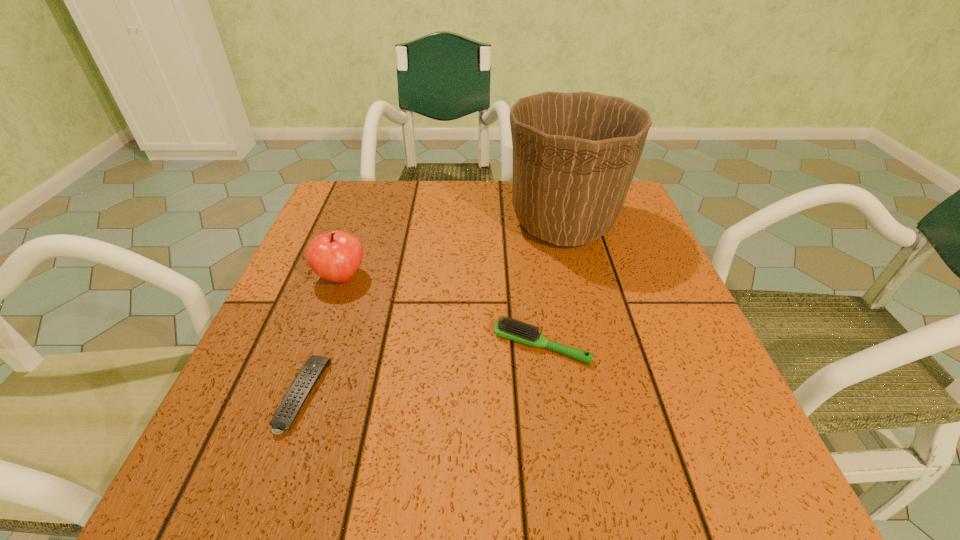
In order to click on object at the far edge in this screenshot , I will do `click(575, 154)`.

Where is `apple at the left edge`? apple at the left edge is located at coordinates (335, 256).

Identify the location of remote control present at the left edge. (294, 399).

Where is `object that is at the right edge`? object that is at the right edge is located at coordinates (575, 154).

The height and width of the screenshot is (540, 960). What are the coordinates of `object present at the far right corner` in the screenshot? It's located at 575,154.

At what (x,y) coordinates should I click in order to perform the action: click on vacant space at the far edge of the desktop. Please return your answer as a coordinate pair (x, y). Image resolution: width=960 pixels, height=540 pixels. Looking at the image, I should click on (404, 204).

You are a GUI agent. You are given a task and a screenshot of the screen. Output one action in this format:
    pyautogui.click(x=<x>, y=<y>)
    Task: Click on the vacant space at the left edge of the desktop
    
    Given the screenshot: What is the action you would take?
    pyautogui.click(x=375, y=235)

Where is `vacant area at the right edge of the desktop`? The height and width of the screenshot is (540, 960). vacant area at the right edge of the desktop is located at coordinates (653, 276).

Image resolution: width=960 pixels, height=540 pixels. What are the coordinates of `vacant space at the near right corner of the desktop` in the screenshot? It's located at (716, 449).

At what (x,y) coordinates should I click in order to perform the action: click on empty space that is in between the remote control and the farthest object. Please return your answer as a coordinate pair (x, y). The height and width of the screenshot is (540, 960). Looking at the image, I should click on (433, 309).